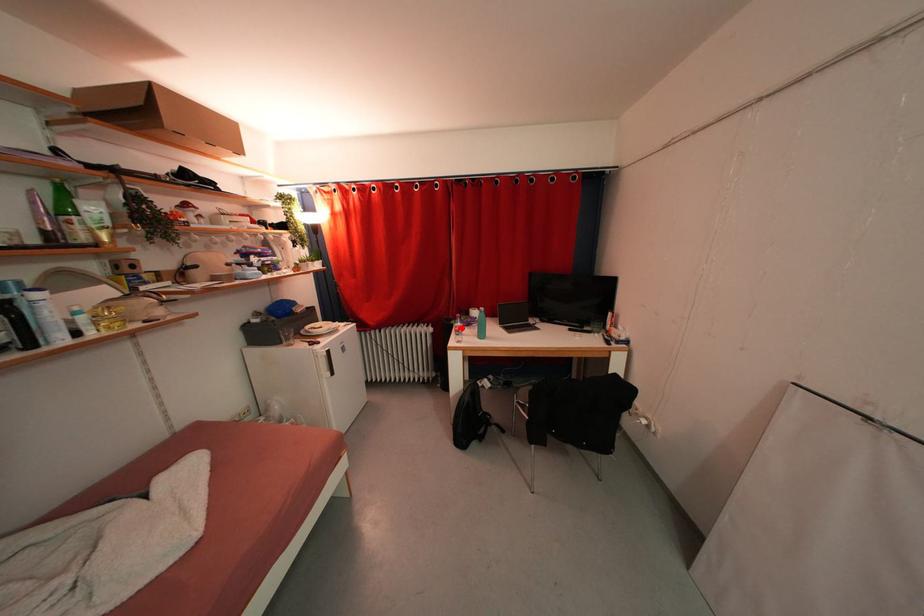
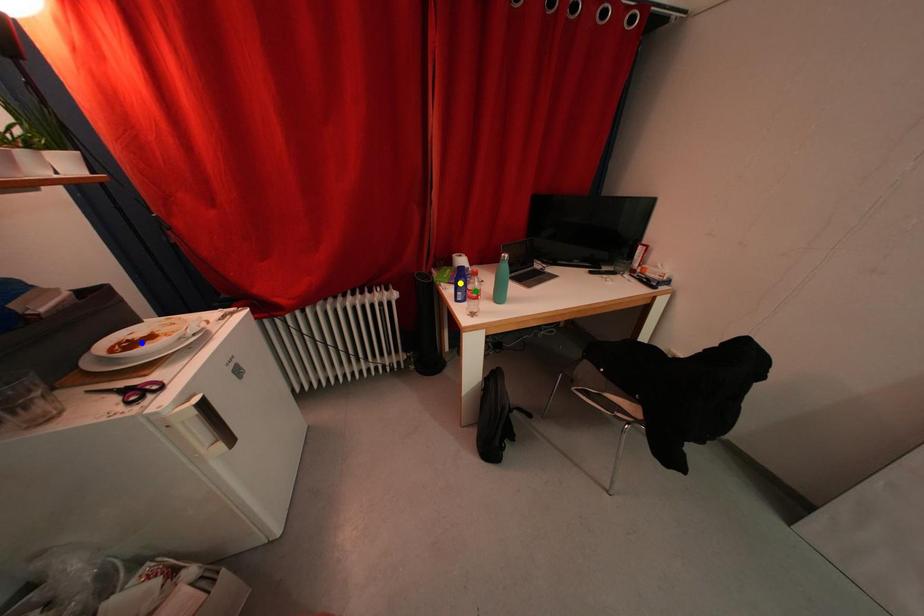
Question: I am providing you with two images of the same scene from different viewpoints. A red point is marked on the first image. You are given multiple points on the second image. Which spot in image 2 lines up with the point in image 1?

Choices:
 (A) blue point
 (B) yellow point
 (C) green point

Answer: (C)